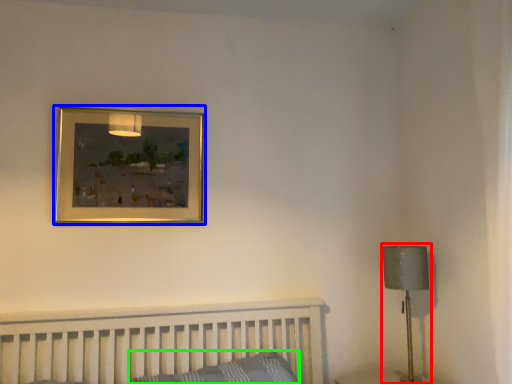
Question: Which object is the farthest from table lamp (highlighted by a red box)? Choose among these: picture frame (highlighted by a blue box) or pillow (highlighted by a green box).

Choices:
 (A) picture frame
 (B) pillow

Answer: (A)